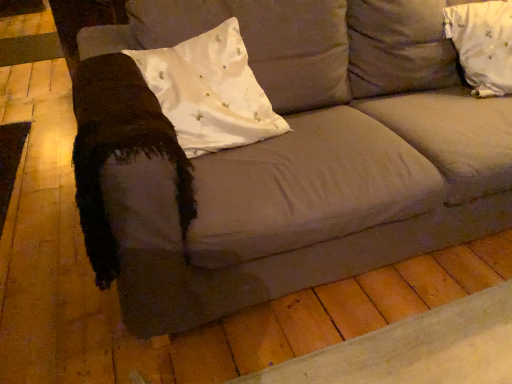
What is the approximate height of white satin pillow at upper right, acting as the 1th pillow starting from the right?

It is 13.84 inches.

Locate an element on the screen. The width and height of the screenshot is (512, 384). white satin pillow at upper right, acting as the 1th pillow starting from the right is located at coordinates (483, 44).

What do you see at coordinates (483, 44) in the screenshot?
I see `white satin pillow at upper right, which appears as the 2th pillow when viewed from the left` at bounding box center [483, 44].

The height and width of the screenshot is (384, 512). What do you see at coordinates (210, 91) in the screenshot?
I see `white satin pillow at left, positioned as the 1th pillow in left-to-right order` at bounding box center [210, 91].

Find the location of a particular element. The height and width of the screenshot is (384, 512). white satin pillow at left, positioned as the 1th pillow in left-to-right order is located at coordinates (210, 91).

What is the approximate height of white satin pillow at left, positioned as the 1th pillow in left-to-right order?

white satin pillow at left, positioned as the 1th pillow in left-to-right order, is 35.01 centimeters tall.

Identify the location of white satin pillow at upper right, which appears as the 2th pillow when viewed from the left. (483, 44).

Considering the positions of objects white satin pillow at upper right, acting as the 1th pillow starting from the right, and white satin pillow at left, positioned as the 2th pillow in right-to-left order, in the image provided, who is more to the right, white satin pillow at upper right, acting as the 1th pillow starting from the right, or white satin pillow at left, positioned as the 2th pillow in right-to-left order,?

white satin pillow at upper right, acting as the 1th pillow starting from the right.

Considering the positions of objects white satin pillow at upper right, acting as the 1th pillow starting from the right, and white satin pillow at left, positioned as the 1th pillow in left-to-right order, in the image provided, who is behind, white satin pillow at upper right, acting as the 1th pillow starting from the right, or white satin pillow at left, positioned as the 1th pillow in left-to-right order,?

white satin pillow at upper right, acting as the 1th pillow starting from the right, is further away from the camera.

Which is further, (464, 10) or (184, 72)?

The point (464, 10) is more distant.

From the image's perspective, which object appears higher, white satin pillow at upper right, acting as the 1th pillow starting from the right, or white satin pillow at left, positioned as the 2th pillow in right-to-left order?

From the image's view, white satin pillow at upper right, acting as the 1th pillow starting from the right, is above.

From a real-world perspective, is white satin pillow at upper right, acting as the 1th pillow starting from the right, below white satin pillow at left, positioned as the 1th pillow in left-to-right order?

Yes, from a real-world perspective, white satin pillow at upper right, acting as the 1th pillow starting from the right, is below white satin pillow at left, positioned as the 1th pillow in left-to-right order.

Which object is wider, white satin pillow at upper right, acting as the 1th pillow starting from the right, or white satin pillow at left, positioned as the 1th pillow in left-to-right order?

Wider between the two is white satin pillow at upper right, acting as the 1th pillow starting from the right.

Considering the sizes of objects white satin pillow at upper right, acting as the 1th pillow starting from the right, and white satin pillow at left, positioned as the 2th pillow in right-to-left order, in the image provided, who is taller, white satin pillow at upper right, acting as the 1th pillow starting from the right, or white satin pillow at left, positioned as the 2th pillow in right-to-left order,?

white satin pillow at upper right, acting as the 1th pillow starting from the right, is taller.

Considering the sizes of objects white satin pillow at upper right, which appears as the 2th pillow when viewed from the left, and white satin pillow at left, positioned as the 1th pillow in left-to-right order, in the image provided, who is smaller, white satin pillow at upper right, which appears as the 2th pillow when viewed from the left, or white satin pillow at left, positioned as the 1th pillow in left-to-right order,?

Smaller between the two is white satin pillow at upper right, which appears as the 2th pillow when viewed from the left.

Would you say white satin pillow at upper right, which appears as the 2th pillow when viewed from the left, contains white satin pillow at left, positioned as the 2th pillow in right-to-left order?

No, white satin pillow at left, positioned as the 2th pillow in right-to-left order, is not surrounded by white satin pillow at upper right, which appears as the 2th pillow when viewed from the left.

Is white satin pillow at upper right, acting as the 1th pillow starting from the right, next to white satin pillow at left, positioned as the 2th pillow in right-to-left order, and touching it?

No.

Is white satin pillow at upper right, which appears as the 2th pillow when viewed from the left, looking in the opposite direction of white satin pillow at left, positioned as the 1th pillow in left-to-right order?

white satin pillow at upper right, which appears as the 2th pillow when viewed from the left, is not turned away from white satin pillow at left, positioned as the 1th pillow in left-to-right order.

Where is `pillow on the left side of white satin pillow at upper right, acting as the 1th pillow starting from the right`? pillow on the left side of white satin pillow at upper right, acting as the 1th pillow starting from the right is located at coordinates (210, 91).

Between white satin pillow at left, positioned as the 2th pillow in right-to-left order, and white satin pillow at upper right, acting as the 1th pillow starting from the right, which one appears on the right side from the viewer's perspective?

white satin pillow at upper right, acting as the 1th pillow starting from the right.

Who is more distant, white satin pillow at left, positioned as the 1th pillow in left-to-right order, or white satin pillow at upper right, acting as the 1th pillow starting from the right?

white satin pillow at upper right, acting as the 1th pillow starting from the right, is further from the camera.

Is point (194, 86) closer to camera compared to point (501, 18)?

Yes, it is.

From the image's perspective, is white satin pillow at left, positioned as the 1th pillow in left-to-right order, located above white satin pillow at upper right, acting as the 1th pillow starting from the right?

No, from the image's perspective, white satin pillow at left, positioned as the 1th pillow in left-to-right order, is not over white satin pillow at upper right, acting as the 1th pillow starting from the right.

From a real-world perspective, is white satin pillow at left, positioned as the 1th pillow in left-to-right order, on top of white satin pillow at upper right, acting as the 1th pillow starting from the right?

Correct, in the physical world, white satin pillow at left, positioned as the 1th pillow in left-to-right order, is higher than white satin pillow at upper right, acting as the 1th pillow starting from the right.

Considering the relative sizes of white satin pillow at left, positioned as the 2th pillow in right-to-left order, and white satin pillow at upper right, which appears as the 2th pillow when viewed from the left, in the image provided, is white satin pillow at left, positioned as the 2th pillow in right-to-left order, thinner than white satin pillow at upper right, which appears as the 2th pillow when viewed from the left,?

Yes, white satin pillow at left, positioned as the 2th pillow in right-to-left order, is thinner than white satin pillow at upper right, which appears as the 2th pillow when viewed from the left.

In terms of height, does white satin pillow at left, positioned as the 2th pillow in right-to-left order, look taller or shorter compared to white satin pillow at upper right, which appears as the 2th pillow when viewed from the left?

Clearly, white satin pillow at left, positioned as the 2th pillow in right-to-left order, is shorter compared to white satin pillow at upper right, which appears as the 2th pillow when viewed from the left.

Who is smaller, white satin pillow at left, positioned as the 1th pillow in left-to-right order, or white satin pillow at upper right, which appears as the 2th pillow when viewed from the left?

Smaller between the two is white satin pillow at upper right, which appears as the 2th pillow when viewed from the left.

Would you say white satin pillow at left, positioned as the 1th pillow in left-to-right order, is outside white satin pillow at upper right, acting as the 1th pillow starting from the right?

Indeed, white satin pillow at left, positioned as the 1th pillow in left-to-right order, is completely outside white satin pillow at upper right, acting as the 1th pillow starting from the right.

Is white satin pillow at left, positioned as the 2th pillow in right-to-left order, far from white satin pillow at upper right, which appears as the 2th pillow when viewed from the left?

They are positioned close to each other.

Is white satin pillow at left, positioned as the 2th pillow in right-to-left order, aimed at white satin pillow at upper right, which appears as the 2th pillow when viewed from the left?

No, white satin pillow at left, positioned as the 2th pillow in right-to-left order, is not aimed at white satin pillow at upper right, which appears as the 2th pillow when viewed from the left.

Based on the photo, can you tell me how much white satin pillow at left, positioned as the 1th pillow in left-to-right order, and white satin pillow at upper right, which appears as the 2th pillow when viewed from the left, differ in facing direction?

The facing directions of white satin pillow at left, positioned as the 1th pillow in left-to-right order, and white satin pillow at upper right, which appears as the 2th pillow when viewed from the left, are 0.000437 degrees apart.

How distant is white satin pillow at left, positioned as the 2th pillow in right-to-left order, from white satin pillow at upper right, acting as the 1th pillow starting from the right?

91.69 centimeters.

Locate an element on the screen. The height and width of the screenshot is (384, 512). pillow that appears on the right of white satin pillow at left, positioned as the 2th pillow in right-to-left order is located at coordinates (483, 44).

At what (x,y) coordinates should I click in order to perform the action: click on pillow to the left of white satin pillow at upper right, which appears as the 2th pillow when viewed from the left. Please return your answer as a coordinate pair (x, y). The height and width of the screenshot is (384, 512). Looking at the image, I should click on (210, 91).

There is a white satin pillow at upper right, which appears as the 2th pillow when viewed from the left. Identify the location of pillow above it (from a real-world perspective). (210, 91).